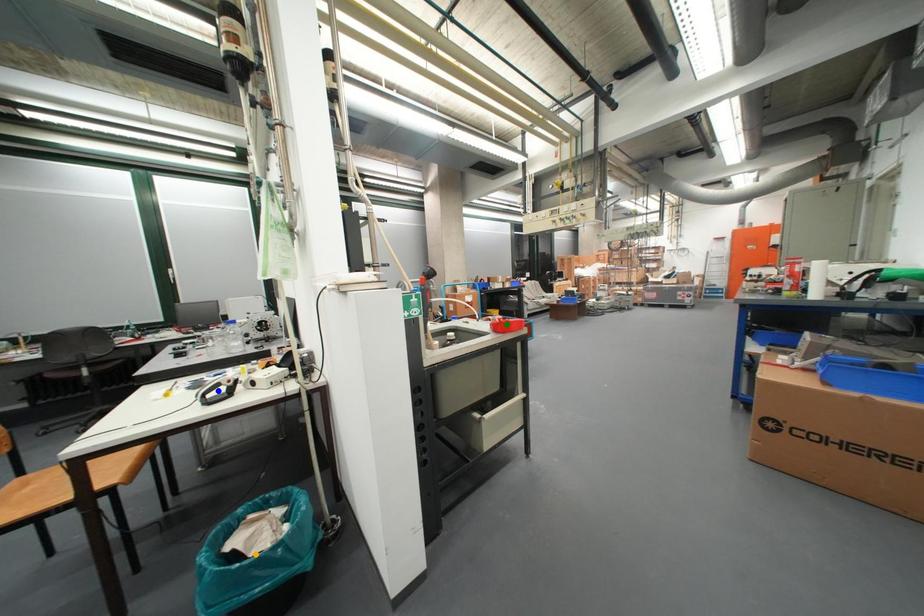
Consider the image. Order these from nearest to farthest:
1. blue point
2. green point
3. orange point

orange point < blue point < green point